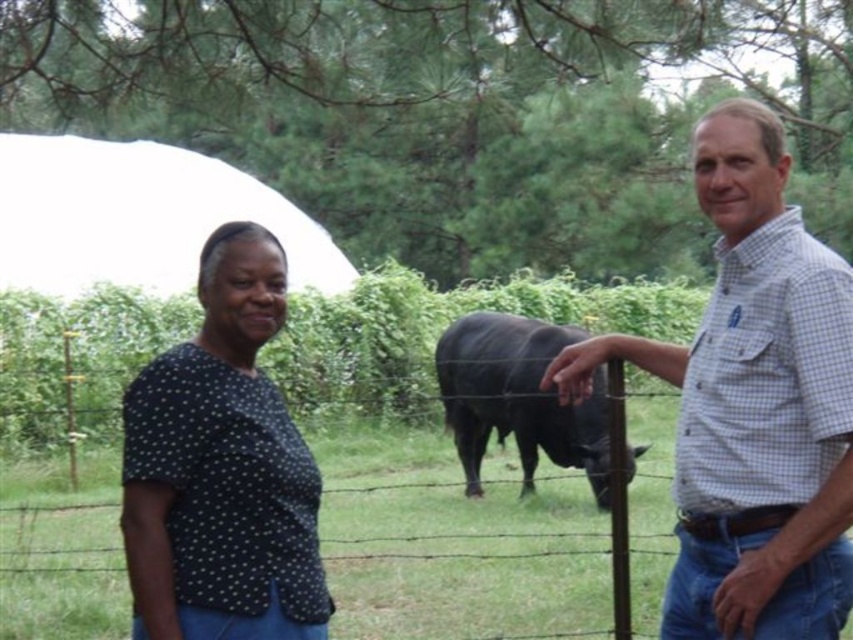
Question: Which object appears closest to the camera in this image?

Choices:
 (A) black dotted shirt at center
 (B) white checkered shirt at right
 (C) black glossy bull at center

Answer: (A)

Question: Which object is positioned closest to the white checkered shirt at right?

Choices:
 (A) black glossy bull at center
 (B) black dotted shirt at center

Answer: (B)

Question: Which object is the farthest from the black dotted shirt at center?

Choices:
 (A) white checkered shirt at right
 (B) black glossy bull at center

Answer: (B)

Question: Is black dotted shirt at center positioned behind black glossy bull at center?

Choices:
 (A) yes
 (B) no

Answer: (B)

Question: Is black dotted shirt at center to the left of black glossy bull at center from the viewer's perspective?

Choices:
 (A) no
 (B) yes

Answer: (B)

Question: In this image, where is white checkered shirt at right located relative to black glossy bull at center?

Choices:
 (A) right
 (B) left

Answer: (A)